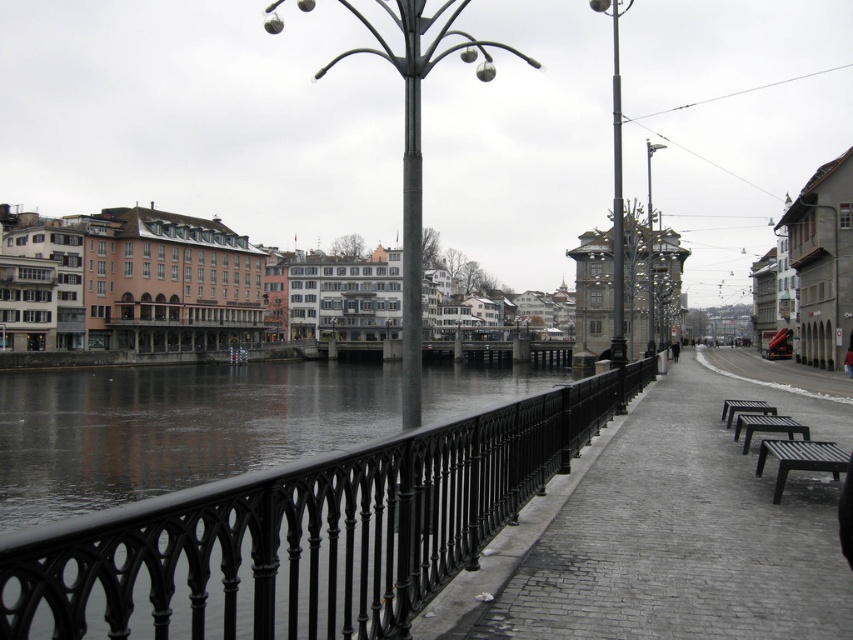
You are a tourist visiting the riverside and want to sit down to enjoy the view. You see the black metal railing at lower left and the black metal bench at lower right. Which object is shorter and therefore more suitable for sitting comfortably?

The black metal bench at lower right is shorter than the black metal railing at lower left, making it the more suitable option for sitting comfortably.

You are a tourist visiting this riverside area and need to sit down for a moment. Both the black metal bench at lower right and the black wooden bench at lower right are available. Which bench would you choose if you prefer more seating space?

The black wooden bench at lower right is larger in size compared to the black metal bench at lower right, so you should choose the black wooden bench at lower right for more seating space.